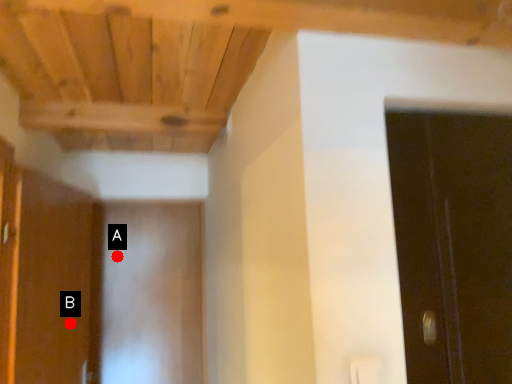
Question: Two points are circled on the image, labeled by A and B beside each circle. Which point is farther from the camera taking this photo?

Choices:
 (A) A is further
 (B) B is further

Answer: (A)